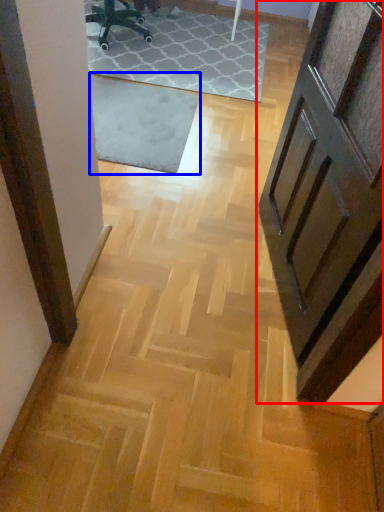
Question: Which point is further to the camera, door (highlighted by a red box) or mat (highlighted by a blue box)?

Choices:
 (A) door
 (B) mat

Answer: (B)